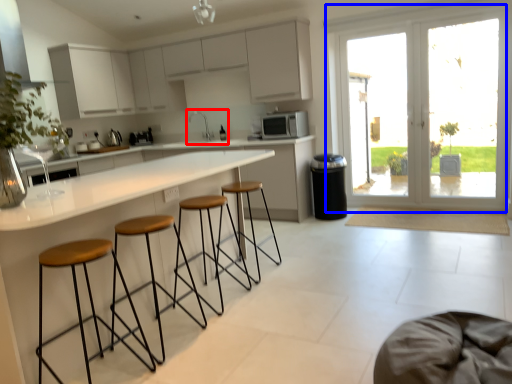
Question: Which point is closer to the camera, sink (highlighted by a red box) or door (highlighted by a blue box)?

Choices:
 (A) sink
 (B) door

Answer: (B)